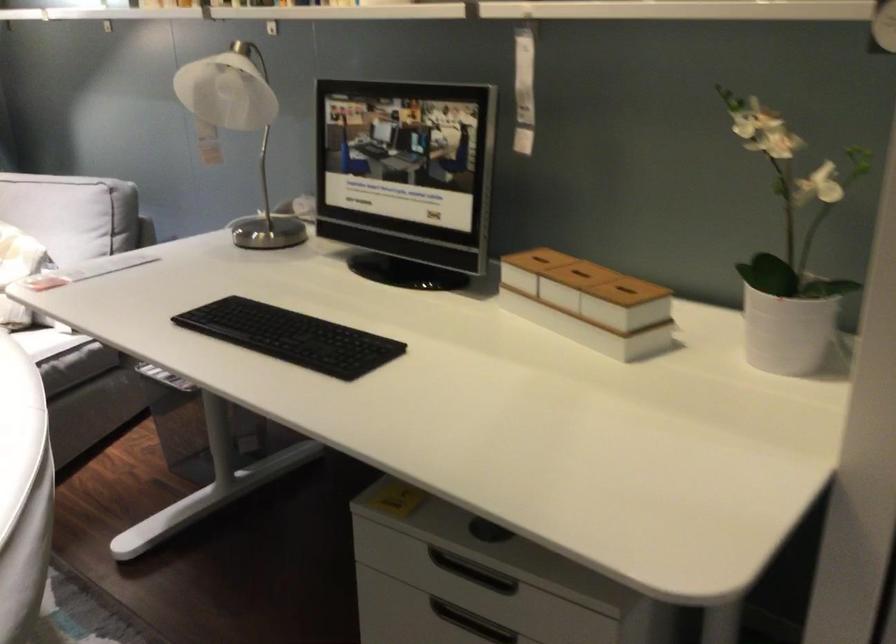
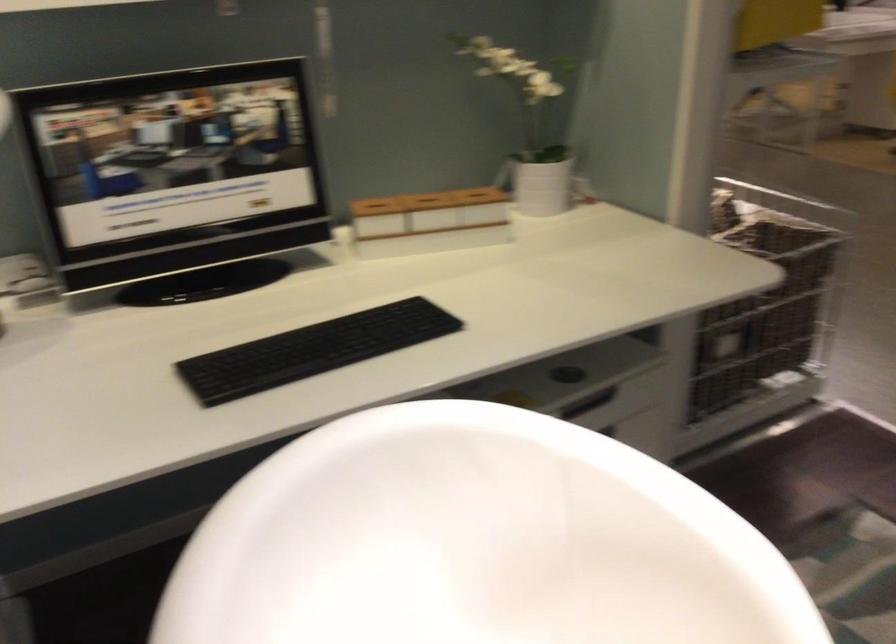
Question: I am providing you with two images of the same scene from different viewpoints. After the viewpoint changes to image2, which objects are now occluded?

Choices:
 (A) cabinet drawer handle
 (B) wooden box lid
 (C) white chair sitting surface
 (D) grey coat hook

Answer: (A)